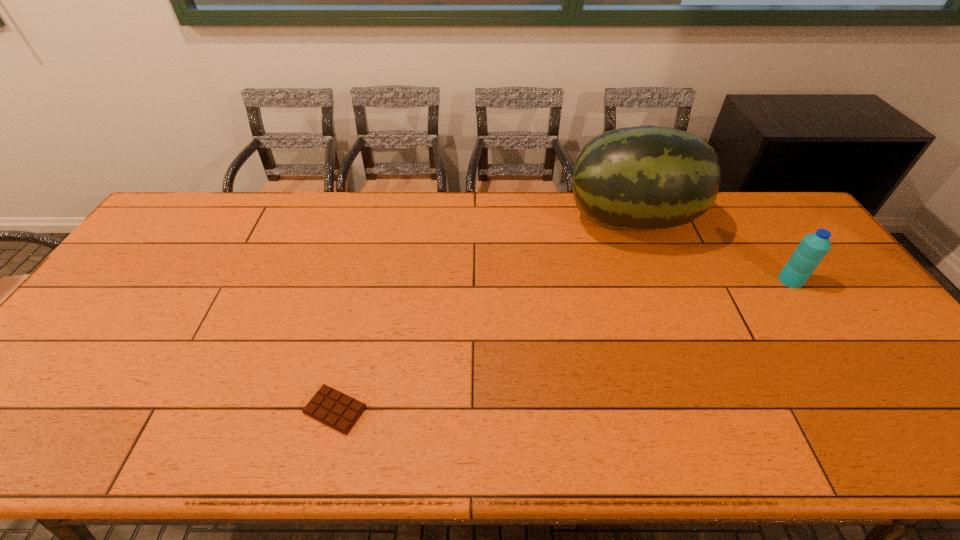
Locate an element on the screen. This screenshot has height=540, width=960. the tallest object is located at coordinates (648, 177).

This screenshot has width=960, height=540. In order to click on the second object from right to left in this screenshot , I will do `click(648, 177)`.

Locate an element on the screen. water bottle is located at coordinates (812, 249).

Where is `the second tallest object`? the second tallest object is located at coordinates (812, 249).

Identify the location of the nearest object. The height and width of the screenshot is (540, 960). (333, 408).

Where is `the shortest object`? The width and height of the screenshot is (960, 540). the shortest object is located at coordinates (333, 408).

This screenshot has height=540, width=960. Find the location of `free space located on the left of the watermelon`. free space located on the left of the watermelon is located at coordinates [x=458, y=220].

The image size is (960, 540). Identify the location of free spot located on the left of the second tallest object. (704, 280).

The width and height of the screenshot is (960, 540). Identify the location of vacant point located on the back of the leftmost object. (369, 274).

Locate an element on the screen. The width and height of the screenshot is (960, 540). object that is at the far edge is located at coordinates (648, 177).